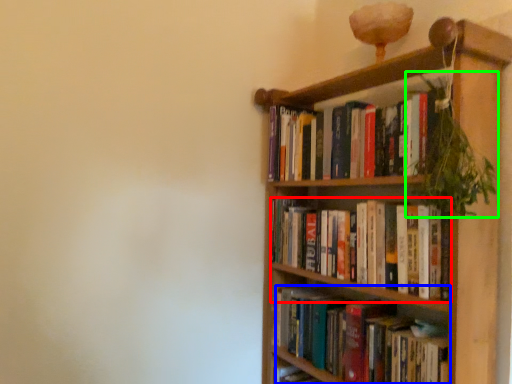
Question: Considering the real-world distances, which object is closest to book (highlighted by a red box)? book (highlighted by a blue box) or vegetation (highlighted by a green box).

Choices:
 (A) book
 (B) vegetation

Answer: (A)